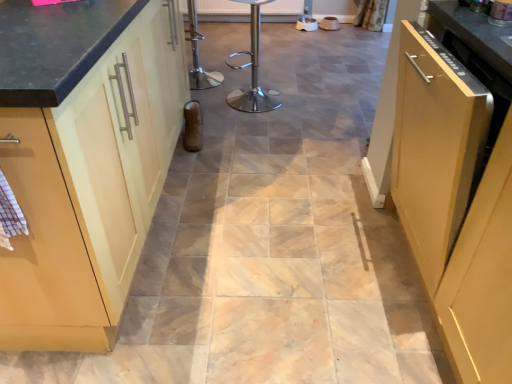
What do you see at coordinates (252, 71) in the screenshot? This screenshot has width=512, height=384. I see `polished stainless steel bar stool at center` at bounding box center [252, 71].

I want to click on matte wood cabinet at left, the first cabinetry in the left-to-right sequence, so click(x=90, y=189).

Is matte wood cabinet at right, marked as the first cabinetry in a right-to-left arrangement, taller or shorter than matte wood cabinet at left, which is counted as the 2th cabinetry, starting from the right?

Clearly, matte wood cabinet at right, marked as the first cabinetry in a right-to-left arrangement, is taller compared to matte wood cabinet at left, which is counted as the 2th cabinetry, starting from the right.

Is matte wood cabinet at right, marked as the first cabinetry in a right-to-left arrangement, spatially inside matte wood cabinet at left, which is counted as the 2th cabinetry, starting from the right, or outside of it?

matte wood cabinet at right, marked as the first cabinetry in a right-to-left arrangement, is spatially situated outside matte wood cabinet at left, which is counted as the 2th cabinetry, starting from the right.

In terms of width, does matte wood cabinet at right, marked as the first cabinetry in a right-to-left arrangement, look wider or thinner when compared to matte wood cabinet at left, which is counted as the 2th cabinetry, starting from the right?

Clearly, matte wood cabinet at right, marked as the first cabinetry in a right-to-left arrangement, has less width compared to matte wood cabinet at left, which is counted as the 2th cabinetry, starting from the right.

From a real-world perspective, which object rests below the other?

In real-world perspective, matte wood cabinet at right, marked as the first cabinetry in a right-to-left arrangement, is lower.

From the image's perspective, is polished stainless steel bar stool at center on matte wood cabinet at right, marked as the first cabinetry in a right-to-left arrangement?

Correct, polished stainless steel bar stool at center appears higher than matte wood cabinet at right, marked as the first cabinetry in a right-to-left arrangement, in the image.

Is polished stainless steel bar stool at center taller or shorter than matte wood cabinet at right, marked as the first cabinetry in a right-to-left arrangement?

Considering their sizes, polished stainless steel bar stool at center has less height than matte wood cabinet at right, marked as the first cabinetry in a right-to-left arrangement.

Considering the sizes of objects polished stainless steel bar stool at center and matte wood cabinet at right, marked as the second cabinetry in a left-to-right arrangement, in the image provided, who is thinner, polished stainless steel bar stool at center or matte wood cabinet at right, marked as the second cabinetry in a left-to-right arrangement,?

Thinner between the two is polished stainless steel bar stool at center.

This screenshot has height=384, width=512. In order to click on bar stool below the matte wood cabinet at right, marked as the second cabinetry in a left-to-right arrangement (from a real-world perspective) in this screenshot , I will do `click(252, 71)`.

From the image's perspective, is polished stainless steel bar stool at center located above matte wood cabinet at left, which is counted as the 2th cabinetry, starting from the right?

Yes.

Does polished stainless steel bar stool at center touch matte wood cabinet at left, the first cabinetry in the left-to-right sequence?

There is a gap between polished stainless steel bar stool at center and matte wood cabinet at left, the first cabinetry in the left-to-right sequence.

How many degrees apart are the facing directions of polished stainless steel bar stool at center and matte wood cabinet at left, which is counted as the 2th cabinetry, starting from the right?

The angle between the facing direction of polished stainless steel bar stool at center and the facing direction of matte wood cabinet at left, which is counted as the 2th cabinetry, starting from the right, is 165 degrees.

Can you confirm if polished stainless steel bar stool at center is shorter than matte wood cabinet at left, the first cabinetry in the left-to-right sequence?

Yes.

From a real-world perspective, is matte wood cabinet at left, which is counted as the 2th cabinetry, starting from the right, physically below matte wood cabinet at right, marked as the first cabinetry in a right-to-left arrangement?

No, from a real-world perspective, matte wood cabinet at left, which is counted as the 2th cabinetry, starting from the right, is not below matte wood cabinet at right, marked as the first cabinetry in a right-to-left arrangement.

Is matte wood cabinet at left, the first cabinetry in the left-to-right sequence, wider or thinner than matte wood cabinet at right, marked as the first cabinetry in a right-to-left arrangement?

Clearly, matte wood cabinet at left, the first cabinetry in the left-to-right sequence, has more width compared to matte wood cabinet at right, marked as the first cabinetry in a right-to-left arrangement.

From the picture: Is matte wood cabinet at left, the first cabinetry in the left-to-right sequence, facing away from matte wood cabinet at right, marked as the second cabinetry in a left-to-right arrangement?

That's not correct — matte wood cabinet at left, the first cabinetry in the left-to-right sequence, is not looking away from matte wood cabinet at right, marked as the second cabinetry in a left-to-right arrangement.

Considering the points (10, 157) and (481, 267), which point is behind, point (10, 157) or point (481, 267)?

Positioned behind is point (481, 267).

Is matte wood cabinet at right, marked as the second cabinetry in a left-to-right arrangement, located within metallic silver dishwasher at upper right?

No, matte wood cabinet at right, marked as the second cabinetry in a left-to-right arrangement, is not surrounded by metallic silver dishwasher at upper right.

Identify the location of the 2nd cabinetry positioned below the metallic silver dishwasher at upper right (from a real-world perspective). (x=455, y=203).

From the image's perspective, which one is positioned higher, metallic silver dishwasher at upper right or matte wood cabinet at right, marked as the second cabinetry in a left-to-right arrangement?

metallic silver dishwasher at upper right, from the image's perspective.

Which object is further away from the camera taking this photo, metallic silver dishwasher at upper right or matte wood cabinet at right, marked as the first cabinetry in a right-to-left arrangement?

metallic silver dishwasher at upper right is further away from the camera.

From a real-world perspective, is matte wood cabinet at right, marked as the first cabinetry in a right-to-left arrangement, physically located above or below polished stainless steel bar stool at center?

Clearly, from a real-world perspective, matte wood cabinet at right, marked as the first cabinetry in a right-to-left arrangement, is above polished stainless steel bar stool at center.

Between matte wood cabinet at right, marked as the second cabinetry in a left-to-right arrangement, and polished stainless steel bar stool at center, which one has less height?

With less height is polished stainless steel bar stool at center.

Is matte wood cabinet at right, marked as the second cabinetry in a left-to-right arrangement, oriented towards polished stainless steel bar stool at center?

No, matte wood cabinet at right, marked as the second cabinetry in a left-to-right arrangement, is not facing towards polished stainless steel bar stool at center.

Measure the distance between matte wood cabinet at right, marked as the first cabinetry in a right-to-left arrangement, and polished stainless steel bar stool at center.

matte wood cabinet at right, marked as the first cabinetry in a right-to-left arrangement, and polished stainless steel bar stool at center are 1.62 meters apart.

From a real-world perspective, is metallic silver dishwasher at upper right positioned under matte wood cabinet at left, which is counted as the 2th cabinetry, starting from the right, based on gravity?

No.

Is metallic silver dishwasher at upper right beside matte wood cabinet at left, the first cabinetry in the left-to-right sequence?

No, metallic silver dishwasher at upper right is not next to matte wood cabinet at left, the first cabinetry in the left-to-right sequence.

From the image's perspective, is metallic silver dishwasher at upper right under matte wood cabinet at left, the first cabinetry in the left-to-right sequence?

No.

Does metallic silver dishwasher at upper right have a greater height compared to matte wood cabinet at left, which is counted as the 2th cabinetry, starting from the right?

No.

This screenshot has height=384, width=512. What are the coordinates of `cabinetry behind the matte wood cabinet at right, marked as the first cabinetry in a right-to-left arrangement` in the screenshot? It's located at (90, 189).

This screenshot has width=512, height=384. I want to click on bar stool above the matte wood cabinet at right, marked as the second cabinetry in a left-to-right arrangement (from the image's perspective), so click(x=252, y=71).

Which object lies further to the anchor point metallic silver dishwasher at upper right, matte wood cabinet at left, the first cabinetry in the left-to-right sequence, or matte wood cabinet at right, marked as the second cabinetry in a left-to-right arrangement?

matte wood cabinet at left, the first cabinetry in the left-to-right sequence, lies further to metallic silver dishwasher at upper right than the other object.

From the image, which object appears to be farther from metallic silver dishwasher at upper right, matte wood cabinet at right, marked as the first cabinetry in a right-to-left arrangement, or polished stainless steel bar stool at center?

The object further to metallic silver dishwasher at upper right is polished stainless steel bar stool at center.

Which object lies nearer to the anchor point matte wood cabinet at left, the first cabinetry in the left-to-right sequence, metallic silver dishwasher at upper right or matte wood cabinet at right, marked as the second cabinetry in a left-to-right arrangement?

matte wood cabinet at right, marked as the second cabinetry in a left-to-right arrangement, is closer to matte wood cabinet at left, the first cabinetry in the left-to-right sequence.

Looking at the image, which one is located closer to polished stainless steel bar stool at center, matte wood cabinet at left, the first cabinetry in the left-to-right sequence, or matte wood cabinet at right, marked as the second cabinetry in a left-to-right arrangement?

matte wood cabinet at left, the first cabinetry in the left-to-right sequence, is positioned closer to the anchor polished stainless steel bar stool at center.

From the image, which object appears to be farther from matte wood cabinet at left, the first cabinetry in the left-to-right sequence, metallic silver dishwasher at upper right or polished stainless steel bar stool at center?

polished stainless steel bar stool at center is further to matte wood cabinet at left, the first cabinetry in the left-to-right sequence.

From the image, which object appears to be farther from matte wood cabinet at right, marked as the first cabinetry in a right-to-left arrangement, metallic silver dishwasher at upper right or polished stainless steel bar stool at center?

polished stainless steel bar stool at center is further to matte wood cabinet at right, marked as the first cabinetry in a right-to-left arrangement.

From the image, which object appears to be farther from matte wood cabinet at left, which is counted as the 2th cabinetry, starting from the right, polished stainless steel bar stool at center or metallic silver dishwasher at upper right?

Among the two, polished stainless steel bar stool at center is located further to matte wood cabinet at left, which is counted as the 2th cabinetry, starting from the right.

Based on the photo, when comparing their distances from polished stainless steel bar stool at center, does metallic silver dishwasher at upper right or matte wood cabinet at right, marked as the first cabinetry in a right-to-left arrangement, seem closer?

metallic silver dishwasher at upper right is closer to polished stainless steel bar stool at center.

This screenshot has width=512, height=384. I want to click on cabinetry between matte wood cabinet at right, marked as the first cabinetry in a right-to-left arrangement, and polished stainless steel bar stool at center in the front-back direction, so click(90, 189).

Locate an element on the screen. The width and height of the screenshot is (512, 384). appliance between matte wood cabinet at left, which is counted as the 2th cabinetry, starting from the right, and polished stainless steel bar stool at center from front to back is located at coordinates (501, 13).

This screenshot has height=384, width=512. In order to click on appliance between matte wood cabinet at left, which is counted as the 2th cabinetry, starting from the right, and matte wood cabinet at right, marked as the first cabinetry in a right-to-left arrangement, in the horizontal direction in this screenshot , I will do `click(501, 13)`.

Where is `appliance located between matte wood cabinet at right, marked as the second cabinetry in a left-to-right arrangement, and polished stainless steel bar stool at center in the depth direction`? The width and height of the screenshot is (512, 384). appliance located between matte wood cabinet at right, marked as the second cabinetry in a left-to-right arrangement, and polished stainless steel bar stool at center in the depth direction is located at coordinates (501, 13).